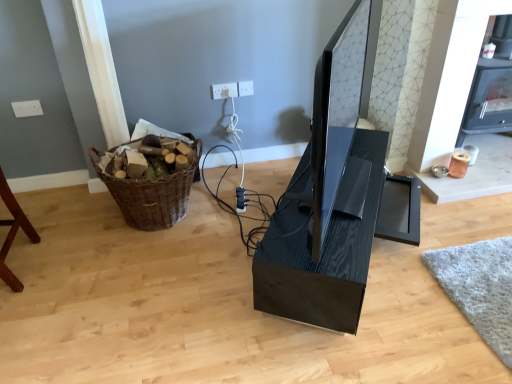
You are a GUI agent. You are given a task and a screenshot of the screen. Output one action in this format:
    pyautogui.click(x=<x>, y=<y>)
    Task: Click on the free area in between black glossy computer desk at center and woven brown basket at left
    
    Given the screenshot: What is the action you would take?
    pyautogui.click(x=224, y=234)